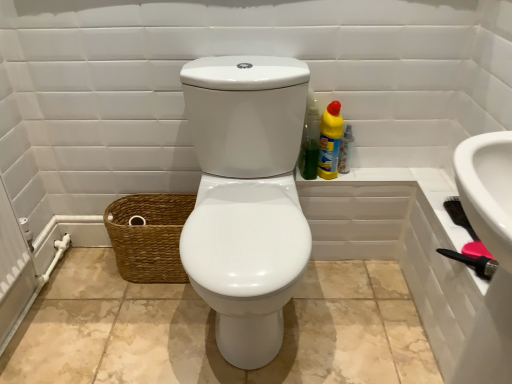
You are a GUI agent. You are given a task and a screenshot of the screen. Output one action in this format:
    pyautogui.click(x=<x>, y=<y>)
    Task: Click on the vacant region to the left of brown woven basket at lower left
    This screenshot has height=384, width=512.
    Given the screenshot: What is the action you would take?
    pyautogui.click(x=89, y=276)